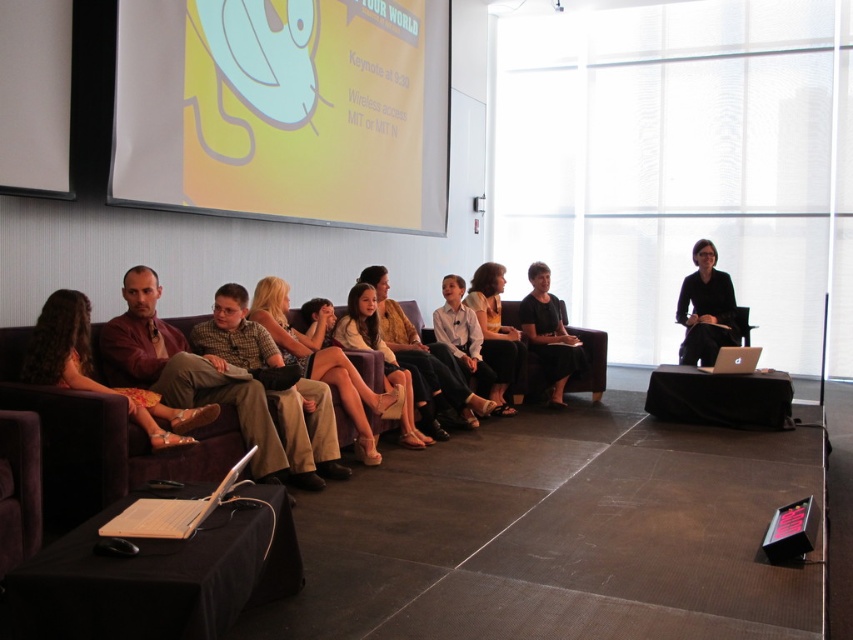
Identify the location of black satin dress at center. The height and width of the screenshot is (640, 853). (548, 332).

Between black satin dress at center and light beige fabric dress at center, which one appears on the left side from the viewer's perspective?

From the viewer's perspective, light beige fabric dress at center appears more on the left side.

This screenshot has height=640, width=853. Find the location of `black satin dress at center`. black satin dress at center is located at coordinates (548, 332).

Does wooden laptop at lower left appear over silver metallic laptop at right?

No.

Is wooden laptop at lower left thinner than silver metallic laptop at right?

Correct, wooden laptop at lower left's width is less than silver metallic laptop at right's.

Based on the photo, who is more distant from viewer, (x=152, y=522) or (x=747, y=355)?

The point (x=747, y=355) is more distant.

The width and height of the screenshot is (853, 640). I want to click on wooden laptop at lower left, so click(170, 512).

Is point (334, 65) closer to camera compared to point (170, 346)?

That is False.

Can you confirm if yellow matte projection screen at upper left is positioned to the right of matte brown pants at center?

Indeed, yellow matte projection screen at upper left is positioned on the right side of matte brown pants at center.

Identify the location of yellow matte projection screen at upper left. Image resolution: width=853 pixels, height=640 pixels. (285, 109).